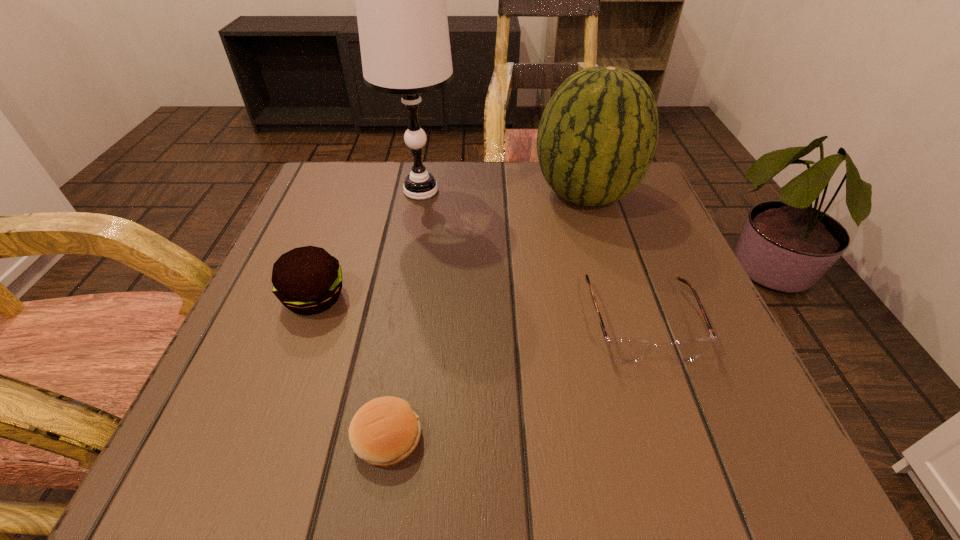
In the image, there is a desktop. Where is `vacant space at the near edge`? The height and width of the screenshot is (540, 960). vacant space at the near edge is located at coordinates (518, 474).

In the image, there is a desktop. Where is `vacant area at the left edge`? The width and height of the screenshot is (960, 540). vacant area at the left edge is located at coordinates (354, 224).

In the image, there is a desktop. Find the location of `vacant space at the right edge`. vacant space at the right edge is located at coordinates (636, 237).

At what (x,y) coordinates should I click in order to perform the action: click on vacant space at the far left corner. Please return your answer as a coordinate pair (x, y). The image size is (960, 540). Looking at the image, I should click on (343, 164).

Locate an element on the screen. vacant region at the far right corner of the desktop is located at coordinates (596, 215).

This screenshot has height=540, width=960. In order to click on free point at the near right corner in this screenshot , I will do `click(735, 471)`.

You are a GUI agent. You are given a task and a screenshot of the screen. Output one action in this format:
    pyautogui.click(x=<x>, y=<y>)
    Task: Click on the free space between the spectacles and the table lamp
    
    Given the screenshot: What is the action you would take?
    pyautogui.click(x=531, y=256)

What are the coordinates of `unoccupied position between the table lamp and the fourth tallest object` in the screenshot? It's located at (531, 256).

You are a GUI agent. You are given a task and a screenshot of the screen. Output one action in this format:
    pyautogui.click(x=<x>, y=<y>)
    Task: Click on the vacant space in between the farther patty and the watermelon
    
    Given the screenshot: What is the action you would take?
    pyautogui.click(x=450, y=247)

The height and width of the screenshot is (540, 960). I want to click on vacant point located between the nearer patty and the second tallest object, so click(x=486, y=316).